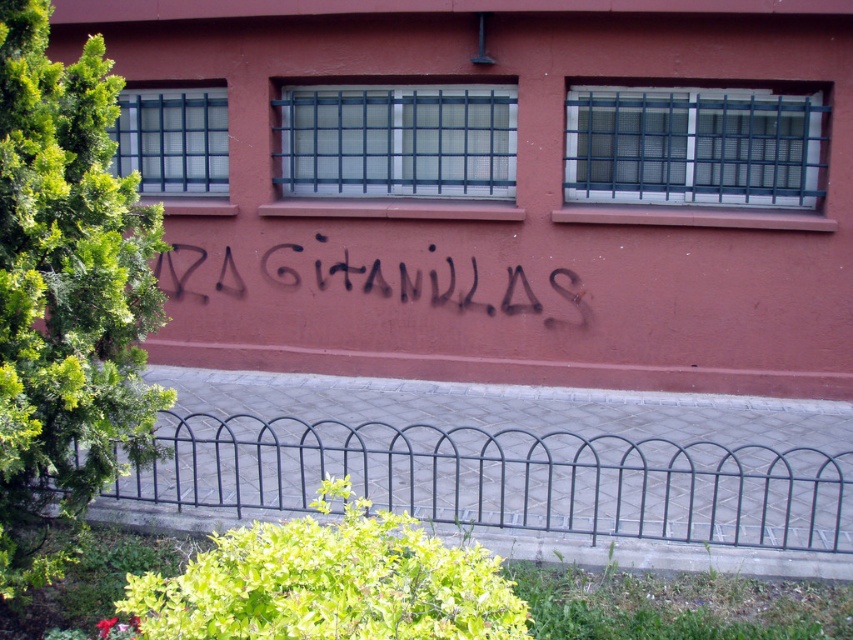
Question: Does black metal fence at lower center appear on the right side of black spray paint graffiti at center?

Choices:
 (A) yes
 (B) no

Answer: (A)

Question: Which of the following is the farthest from the observer?

Choices:
 (A) (502, 428)
 (B) (349, 262)

Answer: (B)

Question: Can you confirm if black metal fence at lower center is wider than black spray paint graffiti at center?

Choices:
 (A) no
 (B) yes

Answer: (B)

Question: Which point appears farthest from the camera in this image?

Choices:
 (A) (212, 259)
 (B) (822, 460)

Answer: (A)

Question: Does black metal fence at lower center lie in front of black spray paint graffiti at center?

Choices:
 (A) no
 (B) yes

Answer: (B)